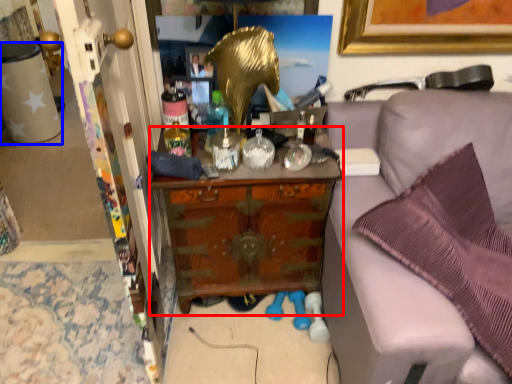
Question: Which object is further to the camera taking this photo, cabinetry (highlighted by a red box) or desk (highlighted by a blue box)?

Choices:
 (A) cabinetry
 (B) desk

Answer: (B)